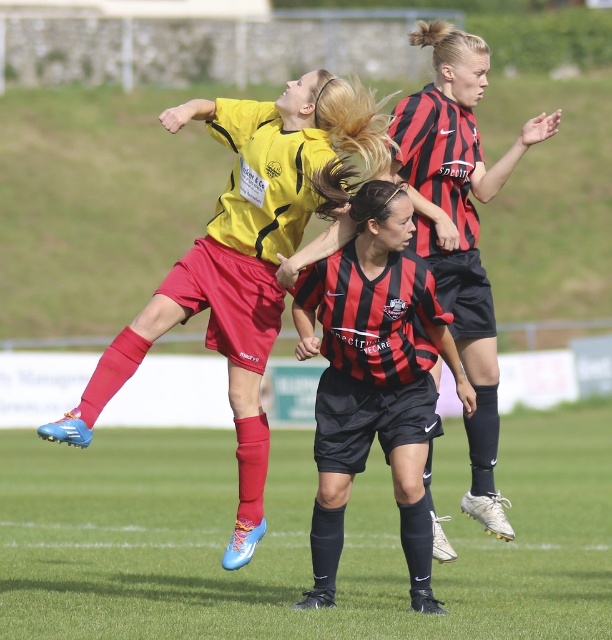
Who is lower down, grass turf football field at center or black matte soccer jersey at center?

grass turf football field at center is below.

Does grass turf football field at center come in front of black matte soccer jersey at center?

Yes, it is in front of black matte soccer jersey at center.

Between point (564, 614) and point (340, 310), which one is positioned behind?

Point (564, 614)

The height and width of the screenshot is (640, 612). I want to click on grass turf football field at center, so tap(299, 538).

Does grass turf football field at center have a smaller size compared to matte yellow jersey at upper center?

No, grass turf football field at center is not smaller than matte yellow jersey at upper center.

Between grass turf football field at center and matte yellow jersey at upper center, which one is positioned higher?

matte yellow jersey at upper center

What do you see at coordinates (299, 538) in the screenshot?
I see `grass turf football field at center` at bounding box center [299, 538].

Find the location of a particular element. grass turf football field at center is located at coordinates (299, 538).

Is grass turf football field at center to the right of black and red striped jersey at upper right from the viewer's perspective?

In fact, grass turf football field at center is to the left of black and red striped jersey at upper right.

Who is lower down, grass turf football field at center or black and red striped jersey at upper right?

Positioned lower is grass turf football field at center.

Which is behind, point (267, 548) or point (539, 134)?

Point (267, 548)

You are a GUI agent. You are given a task and a screenshot of the screen. Output one action in this format:
    pyautogui.click(x=<x>, y=<y>)
    Task: Click on the grass turf football field at center
    The image size is (612, 640).
    Given the screenshot: What is the action you would take?
    pyautogui.click(x=299, y=538)